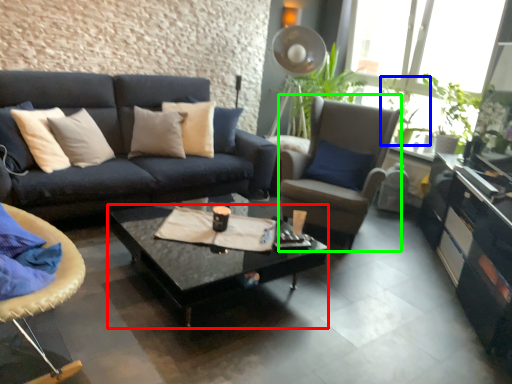
Question: Which is farther away from coffee table (highlighted by a red box)? houseplant (highlighted by a blue box) or chair (highlighted by a green box)?

Choices:
 (A) houseplant
 (B) chair

Answer: (A)